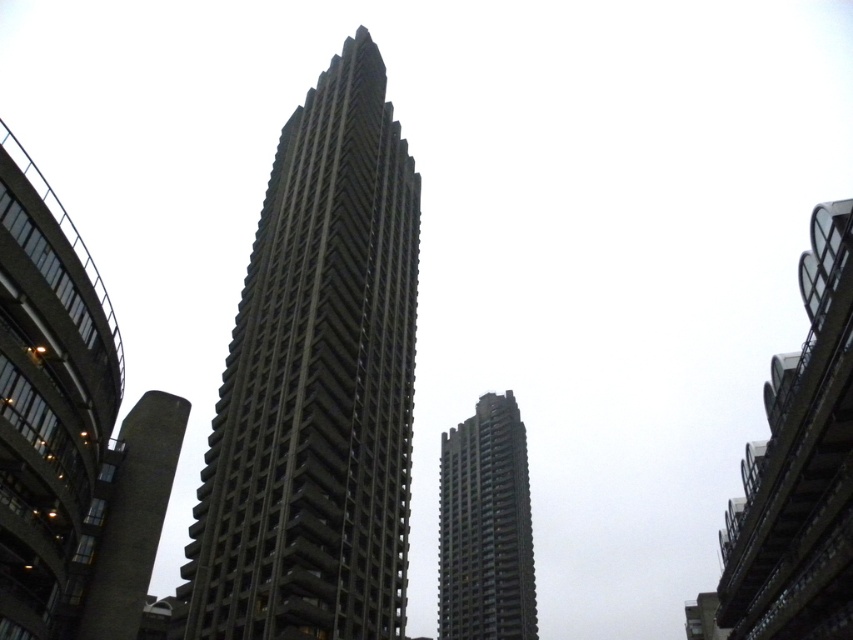
You are standing in the urban landscape scene and want to determine which of the two points, point (339, 496) or point (527, 618), is nearer to you. Based on the scene, which point is closer?

Point (339, 496) is closer to the viewer than point (527, 618).

You are a city planner assessing the space between two central buildings in the image. The gray concrete tower at center and the concrete textured building at center. Given that you need to install a temporary walkway between them for maintenance, what is the minimum length required for the walkway?

The minimum length required for the walkway between the gray concrete tower at center and the concrete textured building at center should be at least 23.00 meters to ensure it spans the distance between them.